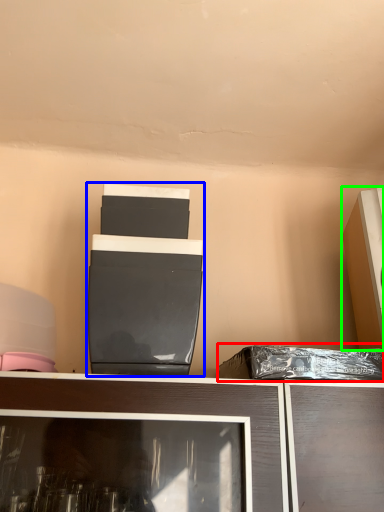
Question: Which object is the closest to the garbage (highlighted by a red box)? Choose among these: appliance (highlighted by a blue box) or appliance (highlighted by a green box).

Choices:
 (A) appliance
 (B) appliance

Answer: (B)